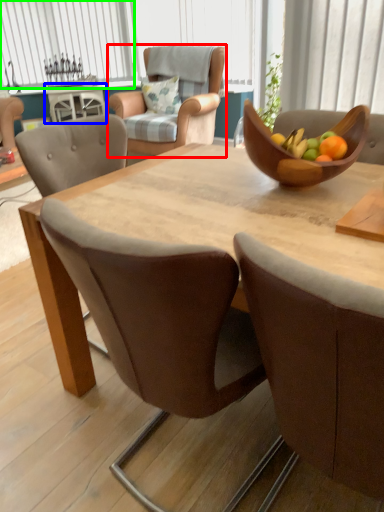
Question: Estimate the real-world distances between objects in this image. Which object is farther from chair (highlighted by a red box), coffee table (highlighted by a blue box) or window (highlighted by a green box)?

Choices:
 (A) coffee table
 (B) window

Answer: (B)